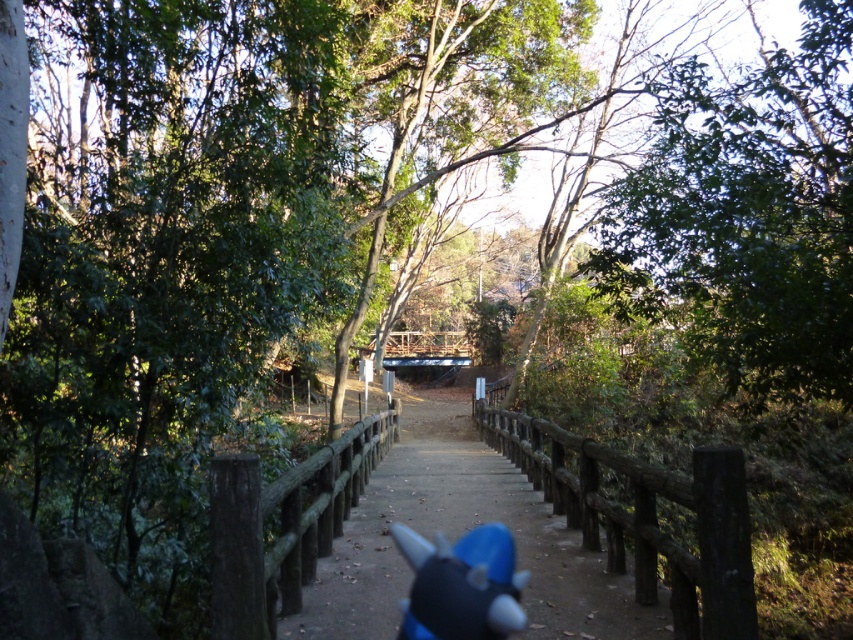
Which is more to the left, brown wooden trail at center or blue plush toy at center?

blue plush toy at center

Looking at this image, is brown wooden trail at center to the right of blue plush toy at center from the viewer's perspective?

Indeed, brown wooden trail at center is positioned on the right side of blue plush toy at center.

Does point (355, 576) come farther from viewer compared to point (473, 572)?

Yes.

Find the location of `brown wooden trail at center`. brown wooden trail at center is located at coordinates (460, 534).